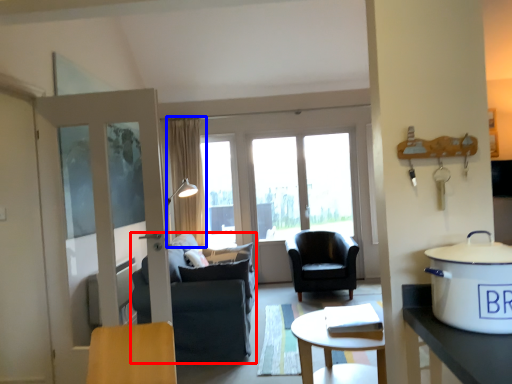
Question: Which object appears farthest to the camera in this image, chair (highlighted by a red box) or curtain (highlighted by a blue box)?

Choices:
 (A) chair
 (B) curtain

Answer: (B)